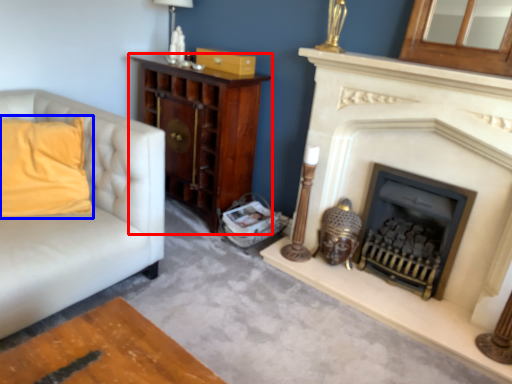
Question: Which object appears farthest to the camera in this image, cabinetry (highlighted by a red box) or pillow (highlighted by a blue box)?

Choices:
 (A) cabinetry
 (B) pillow

Answer: (A)